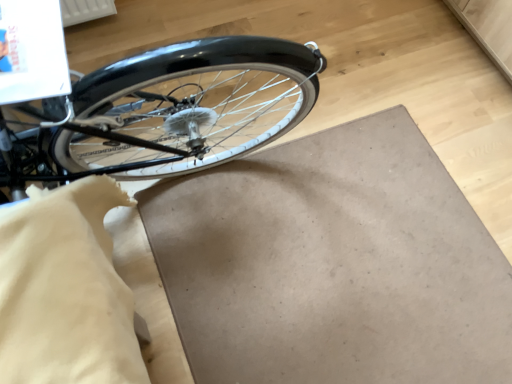
Image resolution: width=512 pixels, height=384 pixels. Identify the location of free space above brown cardboard at upper left (from a real-world perspective). (289, 296).